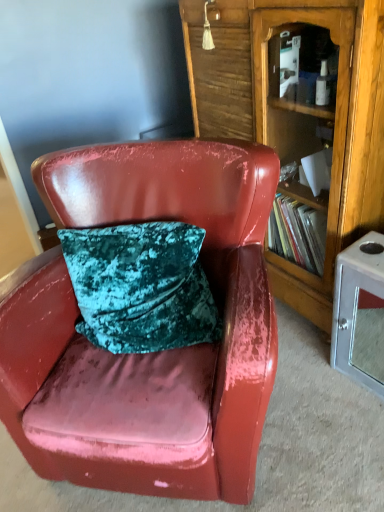
Question: Is glossy leather chair at center placed right next to wooden bookcase at center?

Choices:
 (A) yes
 (B) no

Answer: (B)

Question: Is glossy leather chair at center at the right side of wooden bookcase at center?

Choices:
 (A) no
 (B) yes

Answer: (A)

Question: Is glossy leather chair at center looking in the opposite direction of wooden bookcase at center?

Choices:
 (A) yes
 (B) no

Answer: (A)

Question: Is glossy leather chair at center smaller than wooden bookcase at center?

Choices:
 (A) no
 (B) yes

Answer: (A)

Question: Is glossy leather chair at center taller than wooden bookcase at center?

Choices:
 (A) no
 (B) yes

Answer: (A)

Question: Is metallic silver cabinet at lower right taller or shorter than wooden bookcase at center?

Choices:
 (A) tall
 (B) short

Answer: (B)

Question: Does point (377, 378) appear closer or farther from the camera than point (362, 38)?

Choices:
 (A) farther
 (B) closer

Answer: (A)

Question: Is metallic silver cabinet at lower right wider or thinner than wooden bookcase at center?

Choices:
 (A) thin
 (B) wide

Answer: (A)

Question: In the image, is metallic silver cabinet at lower right on the left side or the right side of wooden bookcase at center?

Choices:
 (A) left
 (B) right

Answer: (B)

Question: From a real-world perspective, is wooden bookcase at center above or below glossy leather chair at center?

Choices:
 (A) above
 (B) below

Answer: (A)

Question: Do you think wooden bookcase at center is within glossy leather chair at center, or outside of it?

Choices:
 (A) outside
 (B) inside

Answer: (A)

Question: In the image, is wooden bookcase at center on the left side or the right side of glossy leather chair at center?

Choices:
 (A) right
 (B) left

Answer: (A)

Question: Is wooden bookcase at center taller or shorter than glossy leather chair at center?

Choices:
 (A) short
 (B) tall

Answer: (B)

Question: Considering the positions of metallic silver cabinet at lower right and glossy leather chair at center in the image, is metallic silver cabinet at lower right taller or shorter than glossy leather chair at center?

Choices:
 (A) short
 (B) tall

Answer: (A)

Question: Looking at the image, does metallic silver cabinet at lower right seem bigger or smaller compared to glossy leather chair at center?

Choices:
 (A) big
 (B) small

Answer: (B)